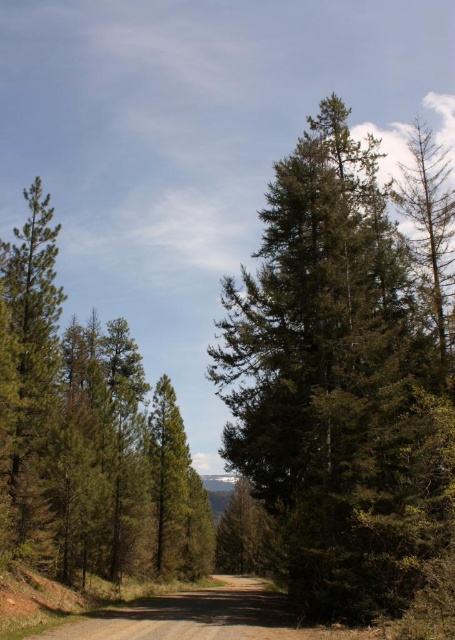
Measure the distance between green textured tree at center and camera.

They are 16.29 meters apart.

Where is `green textured tree at center`? green textured tree at center is located at coordinates (345, 372).

Does green textured pine tree at left have a greater height compared to brown gravel road at center?

Correct, green textured pine tree at left is much taller as brown gravel road at center.

Is point (55, 394) positioned in front of point (264, 614)?

No.

What are the coordinates of `green textured pine tree at left` in the screenshot? It's located at (86, 435).

Between green textured tree at center and green textured pine tree at left, which one is positioned lower?

green textured pine tree at left is lower down.

Which is behind, point (283, 340) or point (129, 444)?

Positioned behind is point (129, 444).

This screenshot has height=640, width=455. What are the coordinates of `green textured tree at center` in the screenshot? It's located at (345, 372).